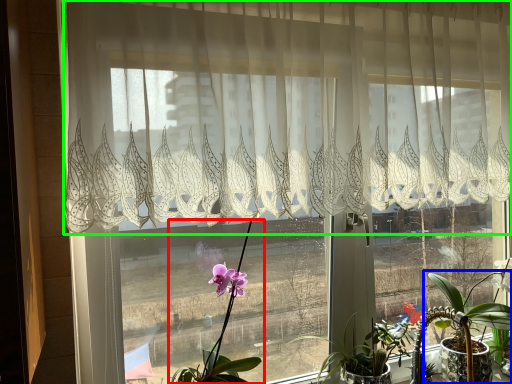
Question: Estimate the real-world distances between objects in this image. Which object is closer to houseplant (highlighted by a red box), houseplant (highlighted by a blue box) or curtain (highlighted by a green box)?

Choices:
 (A) houseplant
 (B) curtain

Answer: (B)